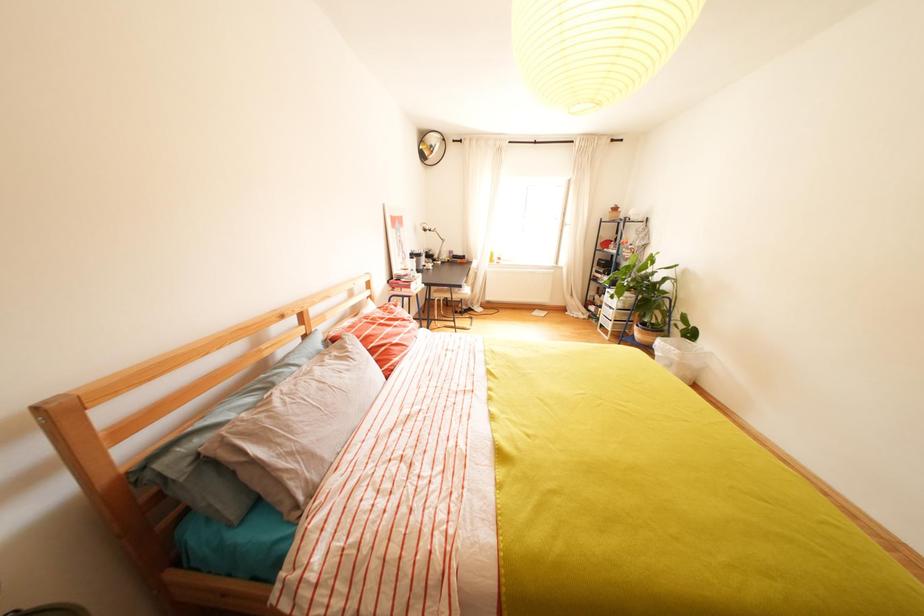
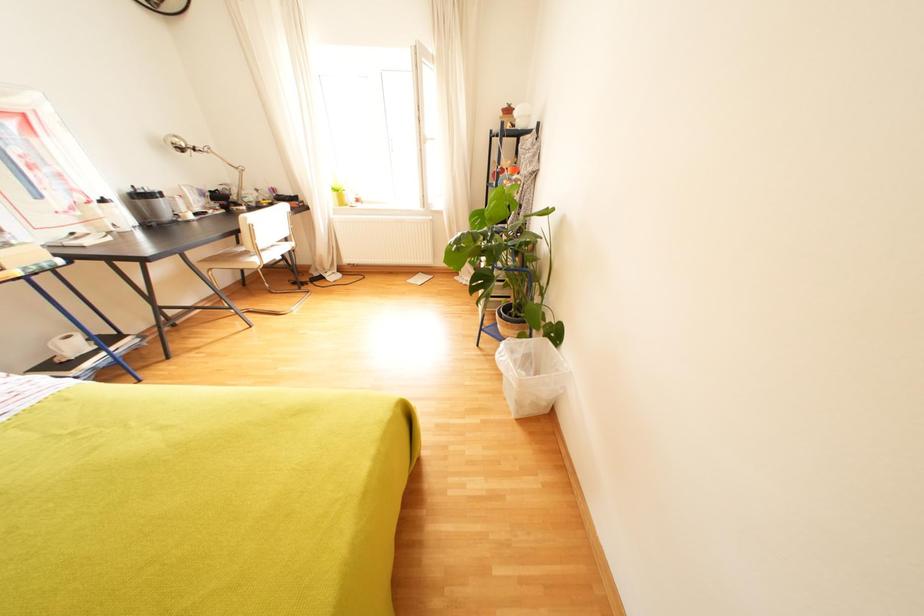
The images are taken continuously from a first-person perspective. In which direction are you moving?

The cameraman moved toward right, forward.